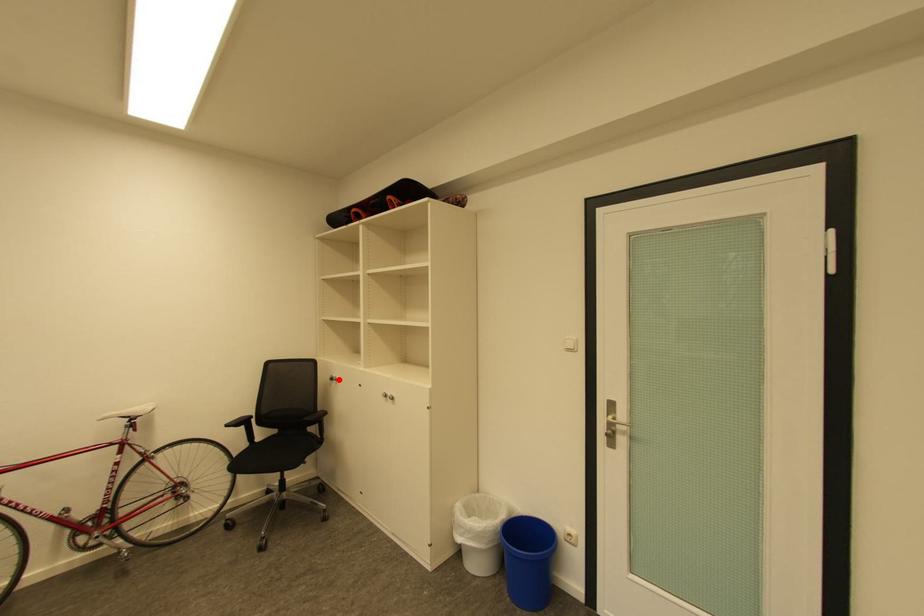
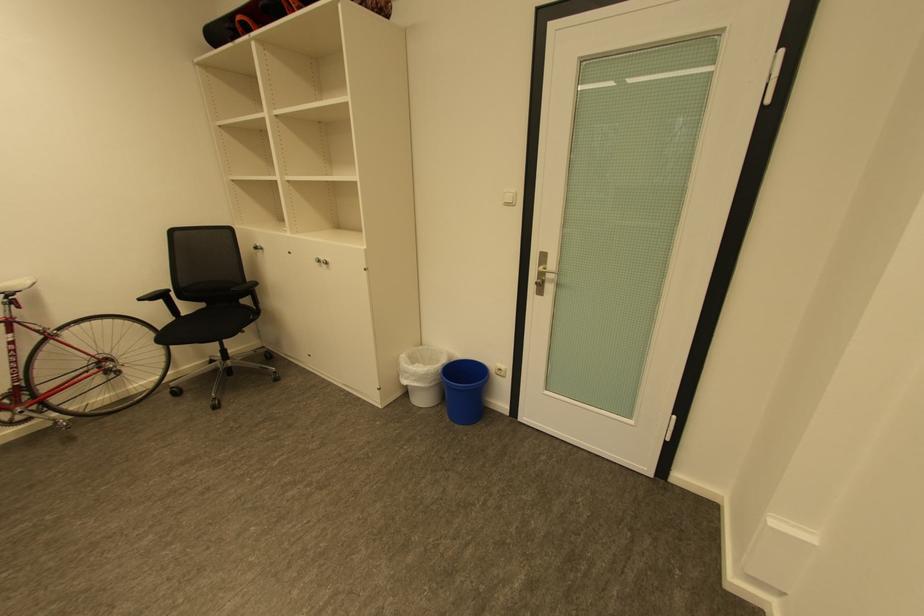
Question: I am providing you with two images of the same scene from different viewpoints. Given a red point in image1, look at the same physical point in image2. Is it:

Choices:
 (A) Closer to the viewpoint
 (B) Farther from the viewpoint

Answer: (A)